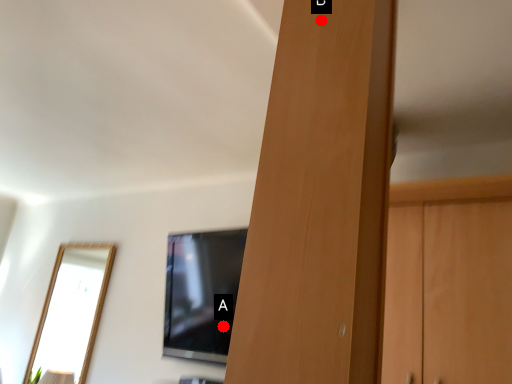
Question: Two points are circled on the image, labeled by A and B beside each circle. Which point is further to the camera?

Choices:
 (A) A is further
 (B) B is further

Answer: (A)